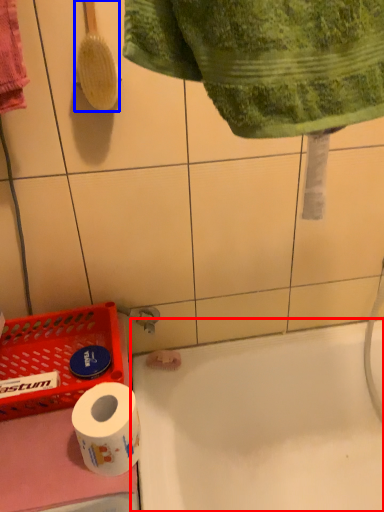
Question: Among these objects, which one is nearest to the camera, bath (highlighted by a red box) or brush (highlighted by a blue box)?

Choices:
 (A) bath
 (B) brush

Answer: (B)